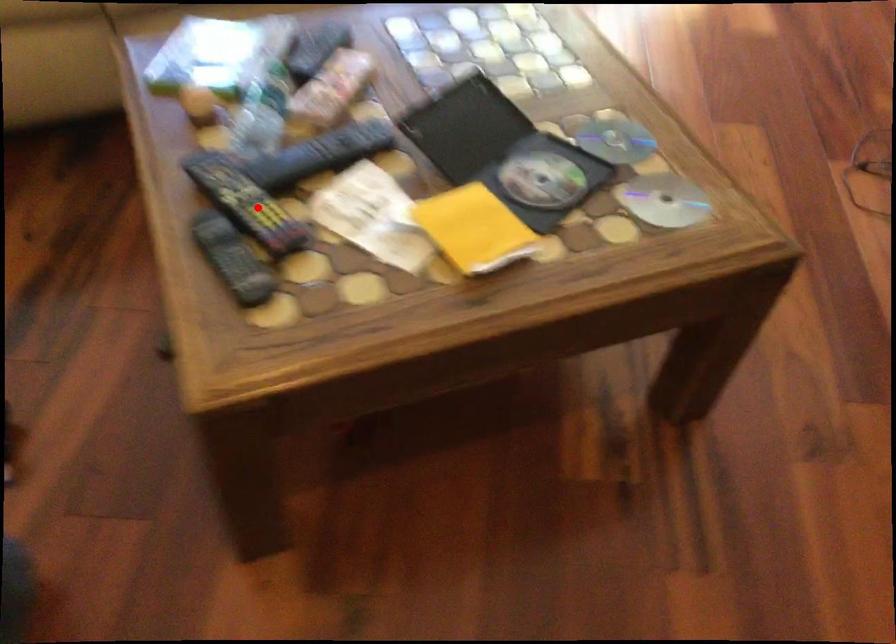
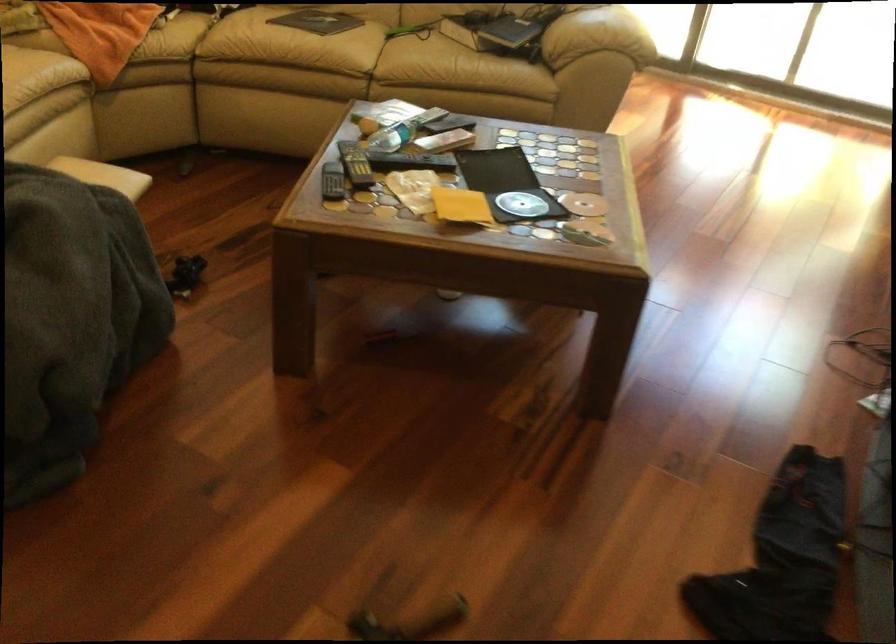
Question: I am providing you with two images of the same scene from different viewpoints. A red point is shown in image1. For the corresponding object point in image2, is it positioned nearer or farther from the camera?

Choices:
 (A) Nearer
 (B) Farther

Answer: (B)